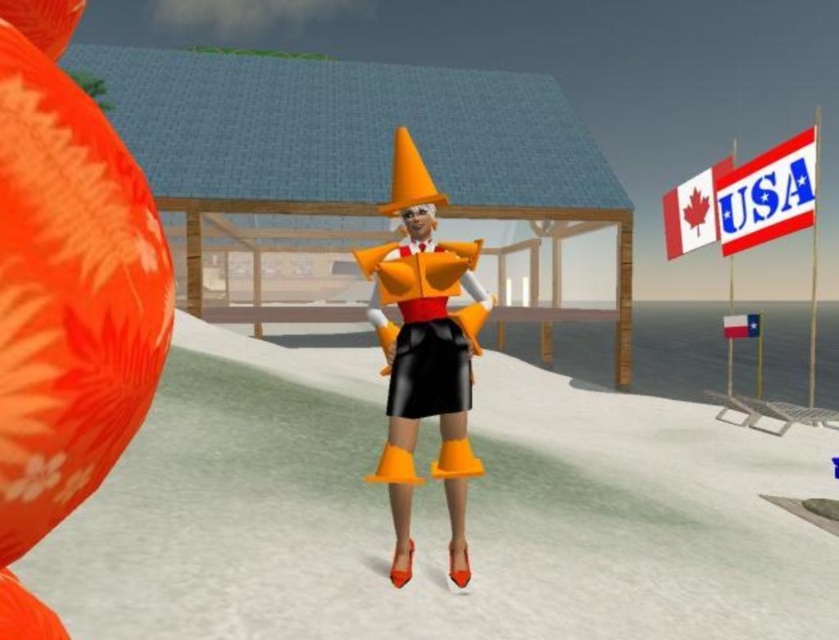
Is point (728, 252) less distant than point (756, 316)?

Yes, it is in front of point (756, 316).

Between point (795, 225) and point (723, 320), which one is positioned in front?

Positioned in front is point (795, 225).

The height and width of the screenshot is (640, 839). Identify the location of white paper flag at upper right. (769, 195).

Who is more distant from viewer, (664,221) or (731,324)?

Positioned behind is point (664,221).

Does point (701, 227) come closer to viewer compared to point (727, 324)?

No.

Identify the location of white fabric flag at upper right. Image resolution: width=839 pixels, height=640 pixels. (692, 211).

Between white paper flag at upper right and white fabric flag at upper right, which one is positioned higher?

white fabric flag at upper right is higher up.

Who is positioned more to the right, white paper flag at upper right or white fabric flag at upper right?

Positioned to the right is white paper flag at upper right.

Which is in front, point (759, 176) or point (692, 220)?

Point (759, 176) is in front.

Locate an element on the screen. white paper flag at upper right is located at coordinates (769, 195).